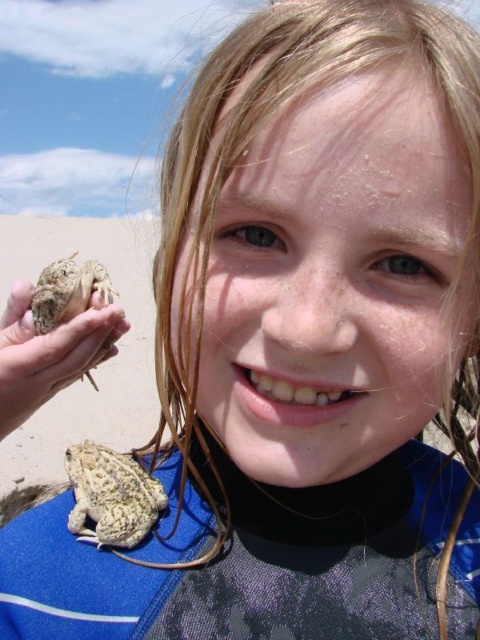
Question: Does speckled brown frog at lower center appear over brown rough skin frog at lower left?

Choices:
 (A) no
 (B) yes

Answer: (A)

Question: Is blue fabric wetsuit at center below smooth beige skin at lower left?

Choices:
 (A) yes
 (B) no

Answer: (A)

Question: Which point is closer to the camera?

Choices:
 (A) blue fabric wetsuit at center
 (B) smooth beige skin at lower left

Answer: (A)

Question: Is smooth beige skin at lower left wider than brown rough skin frog at lower left?

Choices:
 (A) no
 (B) yes

Answer: (A)

Question: Which of the following is the closest to the observer?

Choices:
 (A) speckled brown frog at lower center
 (B) blue fabric wetsuit at center
 (C) brown rough skin frog at lower left

Answer: (B)

Question: Which object is the closest to the speckled brown frog at lower center?

Choices:
 (A) brown rough skin frog at lower left
 (B) smooth beige skin at lower left
 (C) blue fabric wetsuit at center

Answer: (B)